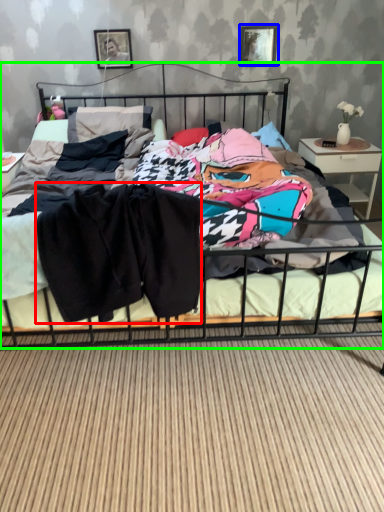
Question: Which is nearer to the clothing (highlighted by a red box)? picture frame (highlighted by a blue box) or bed (highlighted by a green box).

Choices:
 (A) picture frame
 (B) bed

Answer: (B)